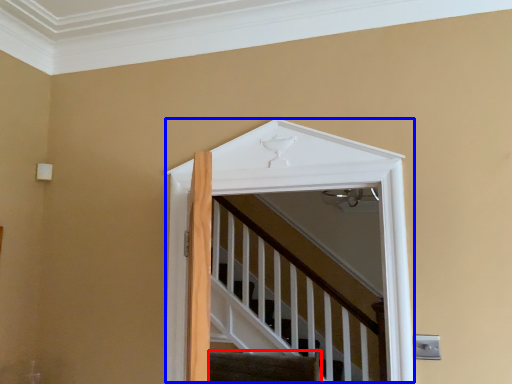
Question: Which object is closer to the camera taking this photo, stairs (highlighted by a red box) or elevator (highlighted by a blue box)?

Choices:
 (A) stairs
 (B) elevator

Answer: (B)